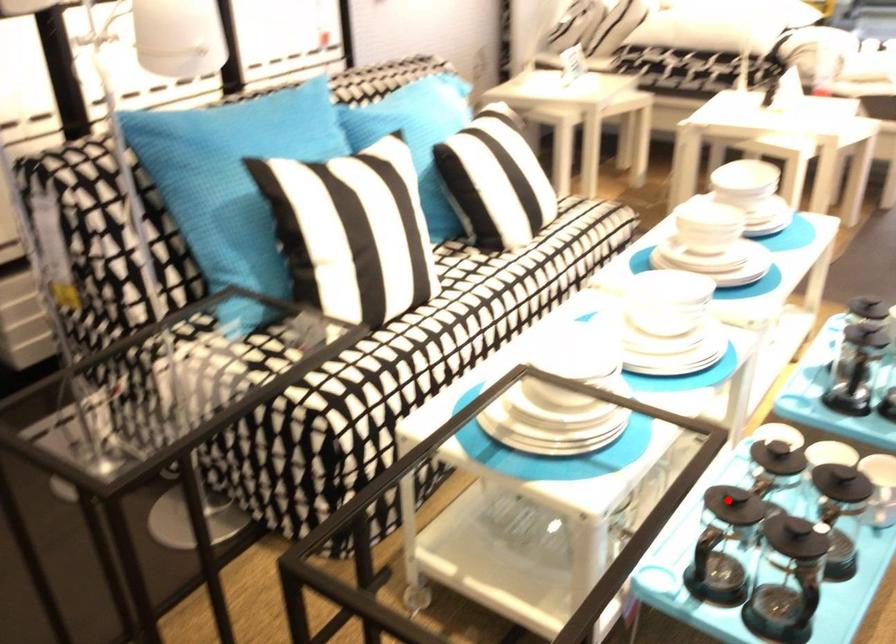
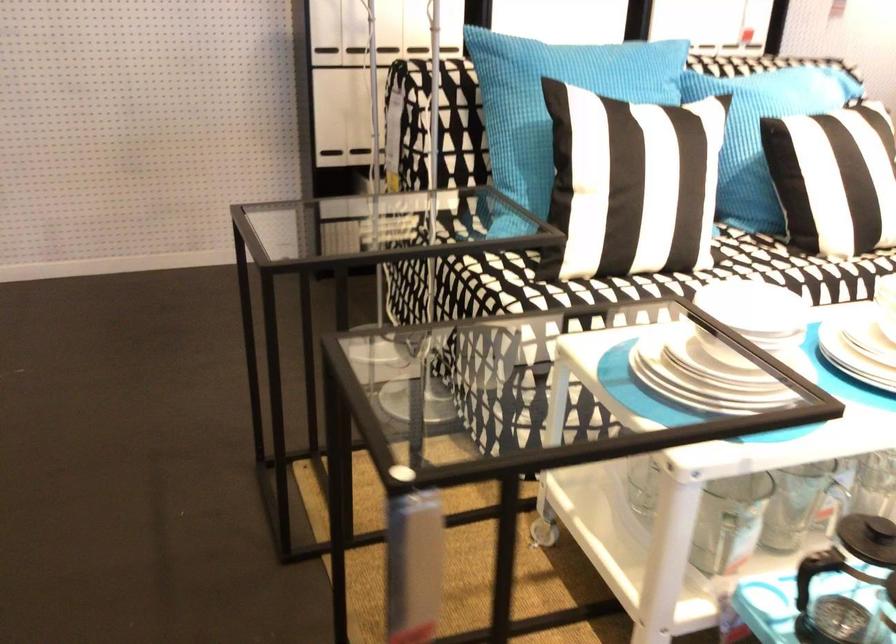
Question: A red point is marked in image1. In image2, is the corresponding 3D point closer to the camera or farther? Reply with the corresponding letter.

Choices:
 (A) The corresponding 3D point is closer.
 (B) The corresponding 3D point is farther.

Answer: (A)